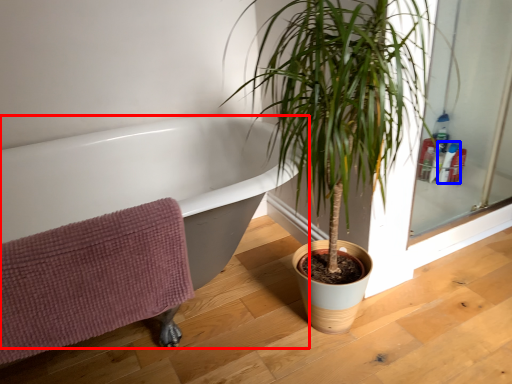
Question: Which of the following is the closest to the observer, bathtub (highlighted by a red box) or toiletry (highlighted by a blue box)?

Choices:
 (A) bathtub
 (B) toiletry

Answer: (A)